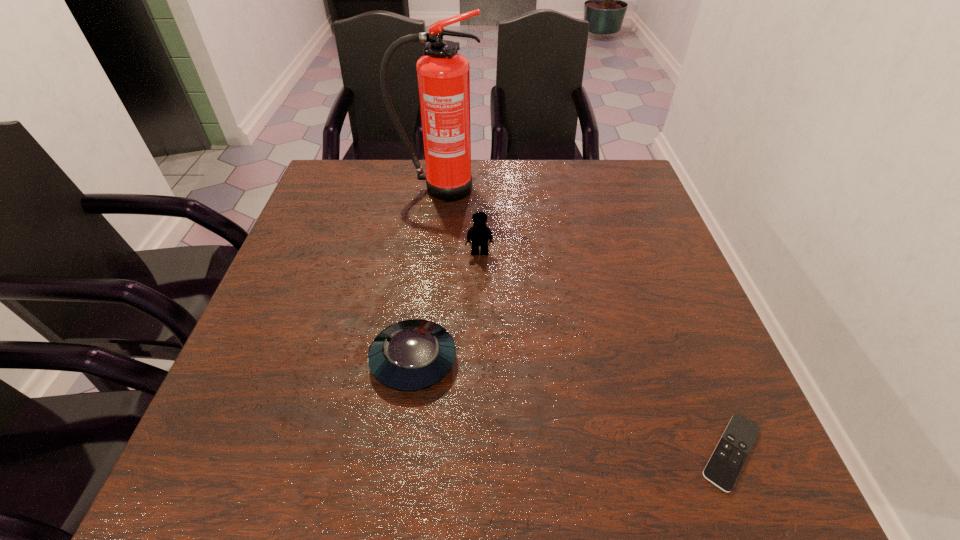
Where is `free space at the far left corner of the desktop`? free space at the far left corner of the desktop is located at coordinates (363, 163).

In order to click on free space at the far right corner in this screenshot , I will do 628,195.

Identify the location of vacant region between the third shortest object and the farthest object. (459, 221).

You are a GUI agent. You are given a task and a screenshot of the screen. Output one action in this format:
    pyautogui.click(x=<x>, y=<y>)
    Task: Click on the free space between the saucer and the Lego
    
    Given the screenshot: What is the action you would take?
    pyautogui.click(x=446, y=306)

Where is `free space between the tallest object and the nearest object`? free space between the tallest object and the nearest object is located at coordinates (585, 320).

You are a GUI agent. You are given a task and a screenshot of the screen. Output one action in this format:
    pyautogui.click(x=<x>, y=<y>)
    Task: Click on the empty space that is in between the shortest object and the Lego
    The width and height of the screenshot is (960, 540).
    Given the screenshot: What is the action you would take?
    pyautogui.click(x=606, y=352)

At what (x,y) coordinates should I click in order to perform the action: click on free point between the Lego and the farthest object. Please return your answer as a coordinate pair (x, y). The height and width of the screenshot is (540, 960). Looking at the image, I should click on (459, 221).

Where is `vacant point located between the third farthest object and the shortest object`? The width and height of the screenshot is (960, 540). vacant point located between the third farthest object and the shortest object is located at coordinates (572, 406).

Image resolution: width=960 pixels, height=540 pixels. In order to click on free space between the saucer and the tallest object in this screenshot , I will do `click(426, 274)`.

Find the location of `vacant area between the third shortest object and the rightmost object`. vacant area between the third shortest object and the rightmost object is located at coordinates (606, 352).